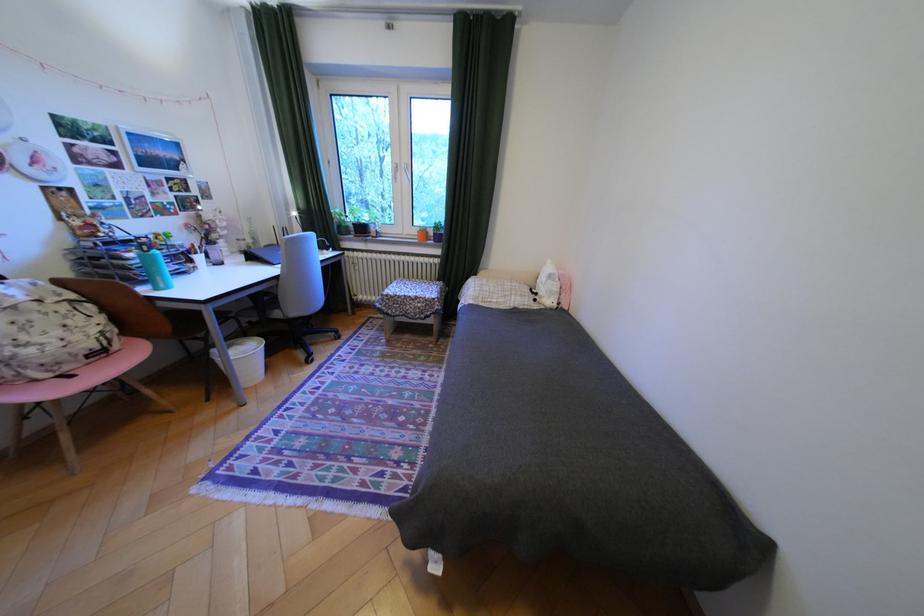
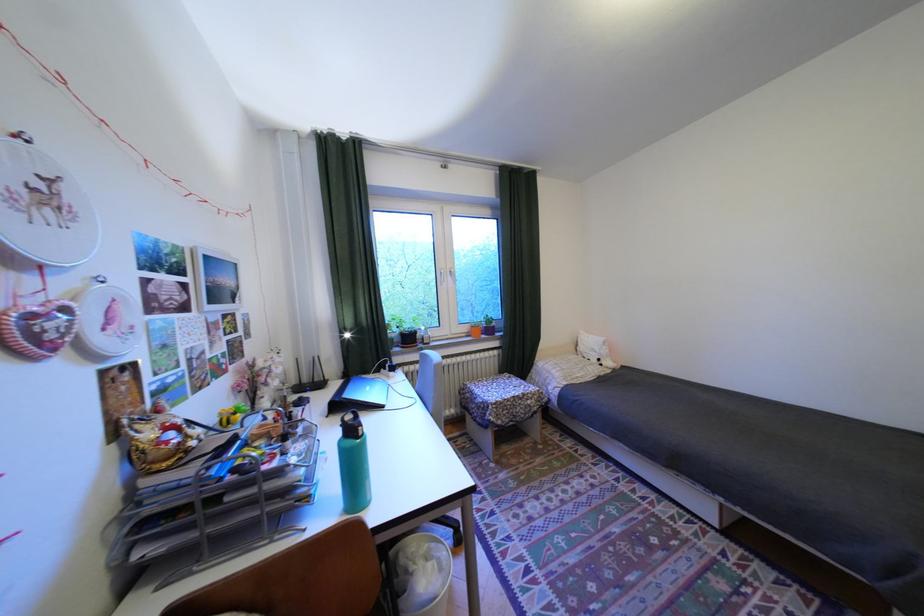
Find the pixel in the second image that matches the point at 402,312 in the first image.

(512, 422)